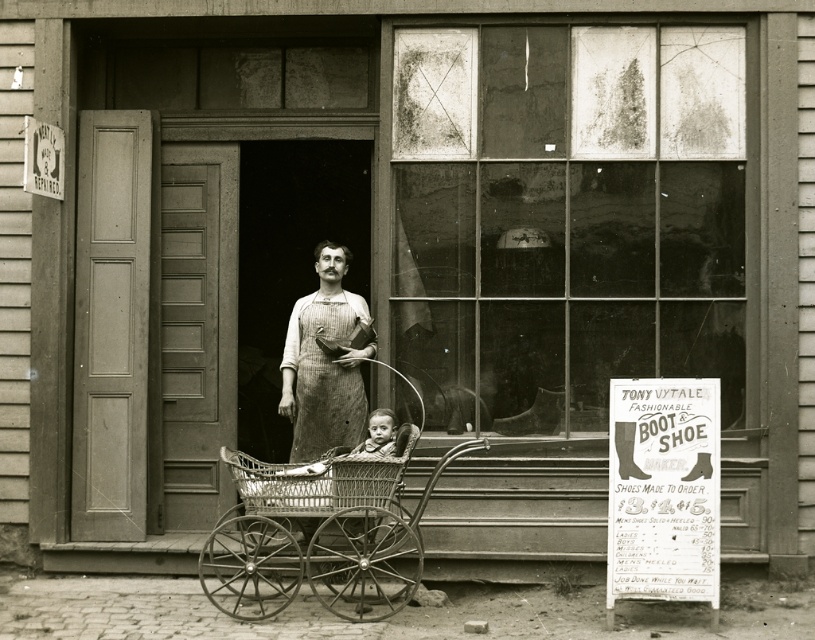
Question: Among these points, which one is nearest to the camera?

Choices:
 (A) (309, 486)
 (B) (342, 376)

Answer: (A)

Question: Does wicker baby carriage at center appear under rustic linen apron at center?

Choices:
 (A) yes
 (B) no

Answer: (A)

Question: Does wicker baby carriage at center appear on the right side of rustic linen apron at center?

Choices:
 (A) yes
 (B) no

Answer: (B)

Question: Does wicker baby carriage at center appear under rustic linen apron at center?

Choices:
 (A) yes
 (B) no

Answer: (A)

Question: Which point appears closest to the camera in this image?

Choices:
 (A) (280, 387)
 (B) (358, 568)

Answer: (B)